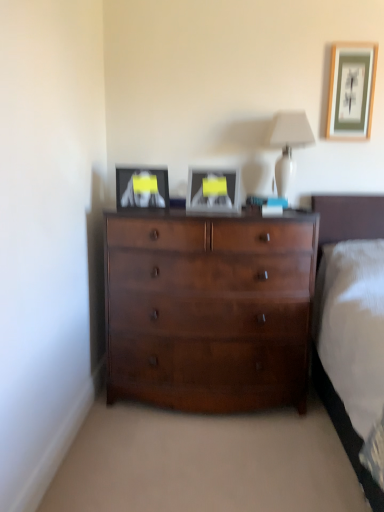
Question: Is white glossy table lamp at upper center spatially inside matte black picture frame at upper left, the third picture frame when ordered from right to left, or outside of it?

Choices:
 (A) outside
 (B) inside

Answer: (A)

Question: Looking at their shapes, would you say white glossy table lamp at upper center is wider or thinner than matte black picture frame at upper left, arranged as the first picture frame when viewed from the left?

Choices:
 (A) wide
 (B) thin

Answer: (A)

Question: Which is farther from the matte black picture frame at upper left, marked as the third picture frame in a top-to-bottom arrangement?

Choices:
 (A) matte silver picture frame at center, acting as the second picture frame starting from the right
 (B) wooden framed artwork at upper right, the third picture frame in the left-to-right sequence
 (C) white glossy table lamp at upper center
 (D) shiny brown dresser at center

Answer: (B)

Question: Which object is the farthest from the white glossy table lamp at upper center?

Choices:
 (A) matte black picture frame at upper left, the third picture frame when ordered from right to left
 (B) matte silver picture frame at center, acting as the second picture frame starting from the right
 (C) wooden framed artwork at upper right, the third picture frame in the left-to-right sequence
 (D) shiny brown dresser at center

Answer: (D)